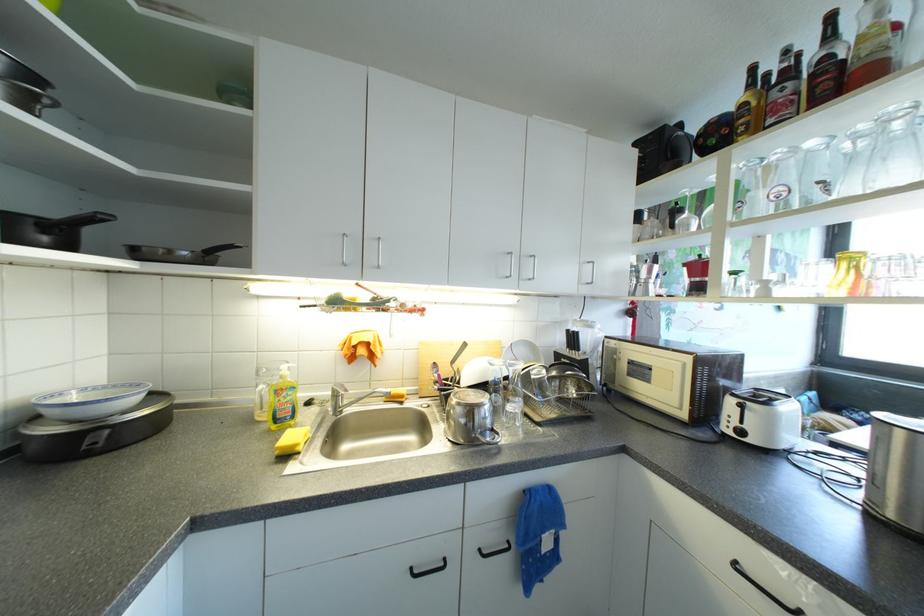
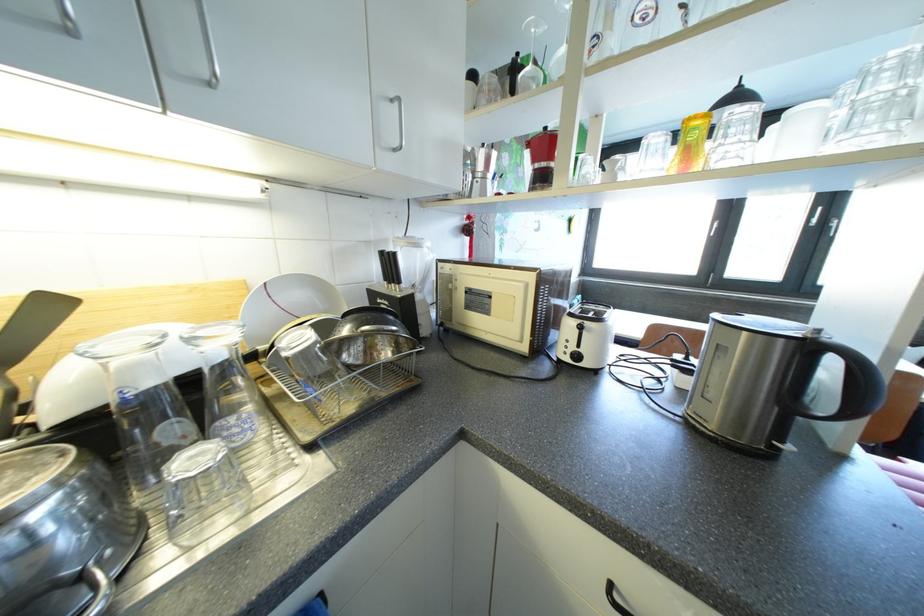
In the second image, find the point that corresponds to [574,334] in the first image.

(387, 256)